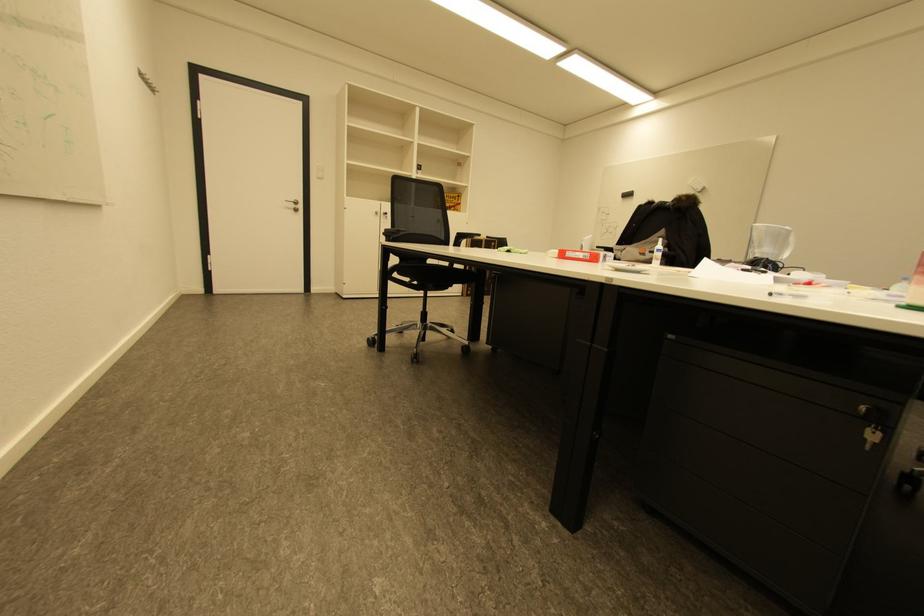
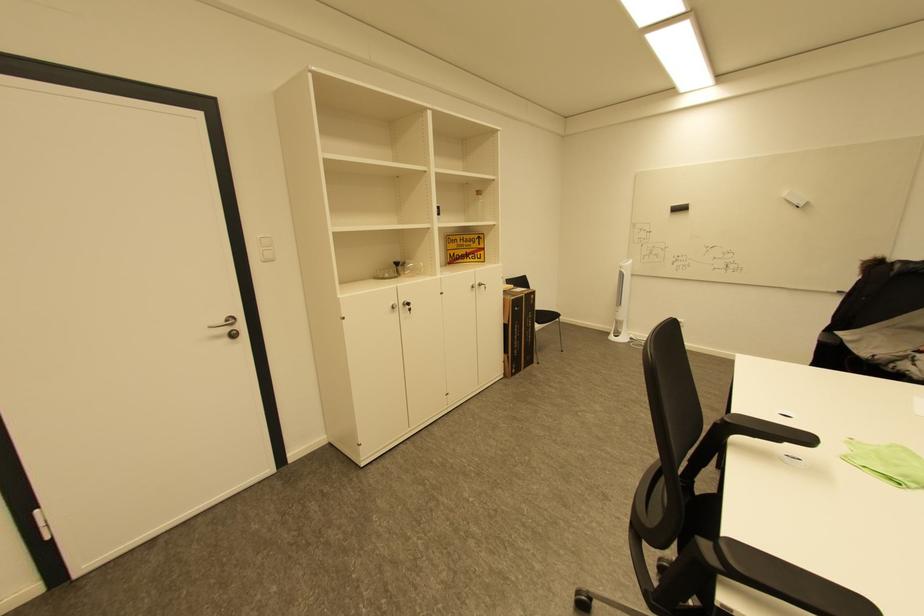
Where in the second image is the point corresponding to point (382, 214) from the first image?

(398, 308)